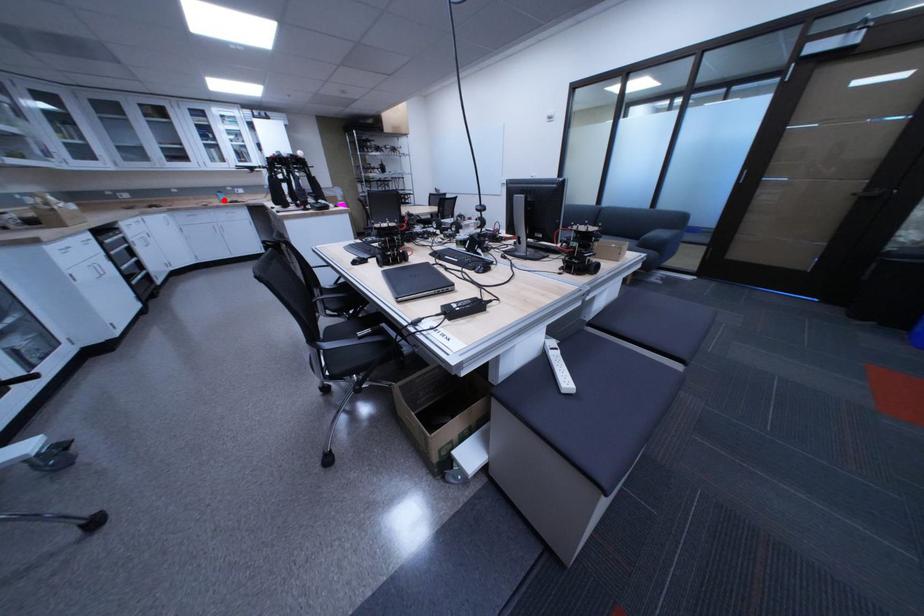
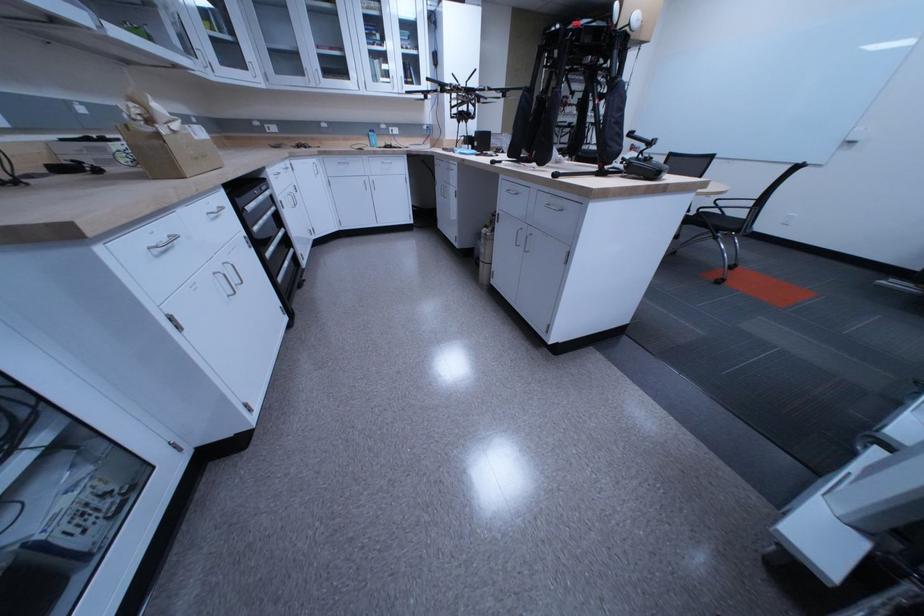
Question: I am providing you with two images of the same scene from different viewpoints. A red point is shown in image1. For the corresponding object point in image2, is it positioned nearer or farther from the camera?

Choices:
 (A) Nearer
 (B) Farther

Answer: (A)